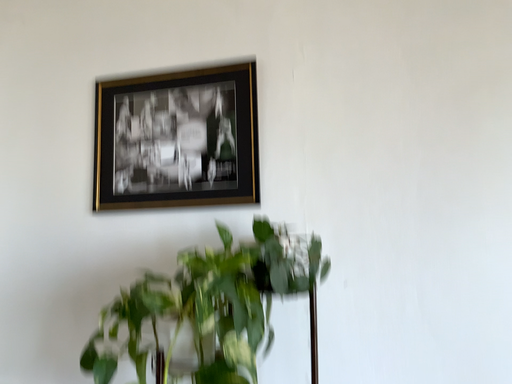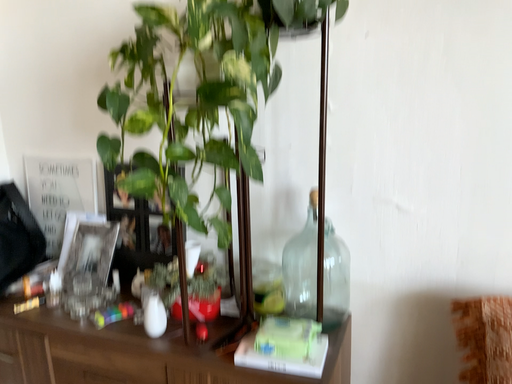
Question: How did the camera likely rotate when shooting the video?

Choices:
 (A) rotated downward
 (B) rotated upward

Answer: (A)